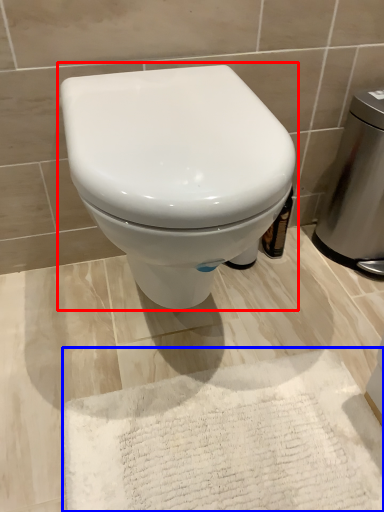
Question: Which object appears closest to the camera in this image, toilet (highlighted by a red box) or bath mat (highlighted by a blue box)?

Choices:
 (A) toilet
 (B) bath mat

Answer: (A)